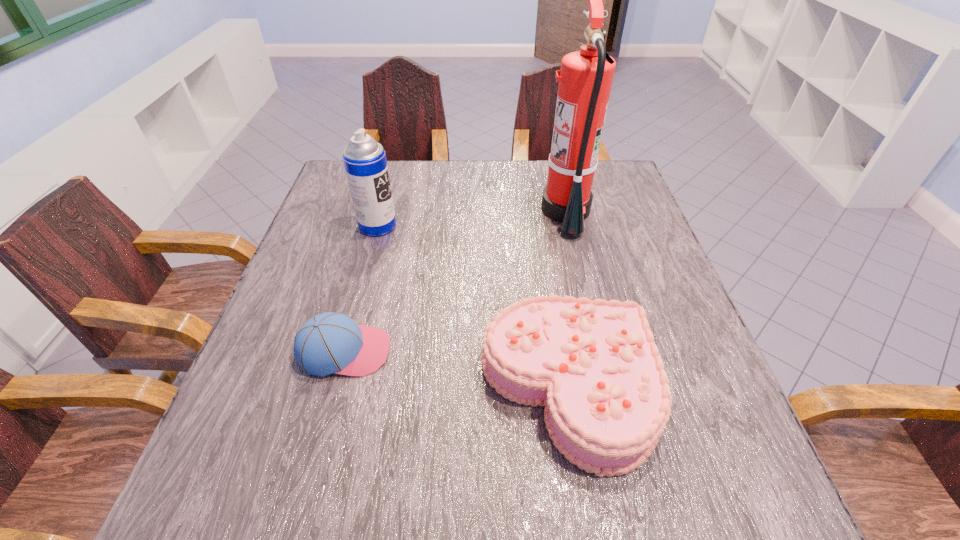
Where is `the tallest object`? Image resolution: width=960 pixels, height=540 pixels. the tallest object is located at coordinates (585, 79).

At what (x,y) coordinates should I click in order to perform the action: click on the third shortest object. Please return your answer as a coordinate pair (x, y). This screenshot has height=540, width=960. Looking at the image, I should click on (365, 163).

You are a GUI agent. You are given a task and a screenshot of the screen. Output one action in this format:
    pyautogui.click(x=<x>, y=<y>)
    Task: Click on the cake
    
    Given the screenshot: What is the action you would take?
    pyautogui.click(x=594, y=365)

At what (x,y) coordinates should I click in order to perform the action: click on baseball cap. Please return your answer as a coordinate pair (x, y). This screenshot has width=960, height=540. Looking at the image, I should click on (330, 342).

Locate an element on the screen. vacant region located 0.320m at the nozzle of the fire extinguisher is located at coordinates (427, 211).

Where is `vacant space located at the nozzle of the fire extinguisher`? vacant space located at the nozzle of the fire extinguisher is located at coordinates (470, 211).

This screenshot has height=540, width=960. I want to click on blank area located at the nozzle of the fire extinguisher, so click(x=470, y=211).

At what (x,y) coordinates should I click in order to perform the action: click on vacant space positioned on the label side of the aerosol can. Please return your answer as a coordinate pair (x, y). Looking at the image, I should click on (496, 226).

I want to click on blank area located on the back of the cake, so click(542, 228).

Where is `vacant region located on the front-facing side of the baseball cap`? This screenshot has height=540, width=960. vacant region located on the front-facing side of the baseball cap is located at coordinates (519, 351).